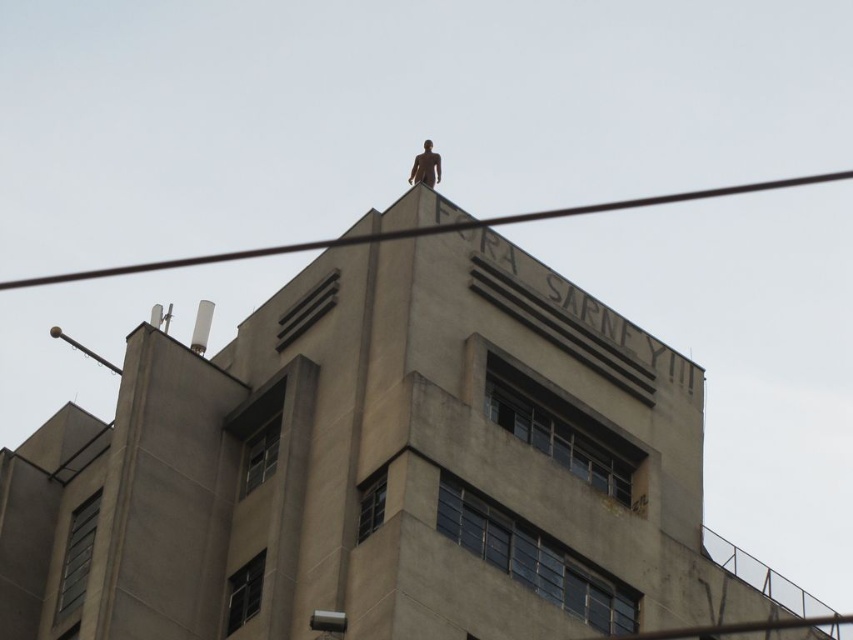
You are an electrician inspecting the roof of the building. You notice the black wire at upper center and the bronze statue at top. Which object is bigger in size?

The black wire at upper center is larger in size compared to the bronze statue at top.

You are an electrician inspecting the roof of the building. You notice the black wire at upper center and the bronze statue at top. Which object is nearer to you as you stand on the roof?

The black wire at upper center is closer to the viewer than the bronze statue at top, so the black wire at upper center is nearer to you as you stand on the roof.

You are standing 100 meters away from the building. If you walk towards the building, will you pass the point at coordinates point (x=64, y=280) before reaching the building?

The distance of point (x=64, y=280) from viewer is 206.15 meters. Since you are currently 100 meters away from the building, you are closer to the building than the point. Therefore, you will reach the building before passing the point (x=64, y=280).